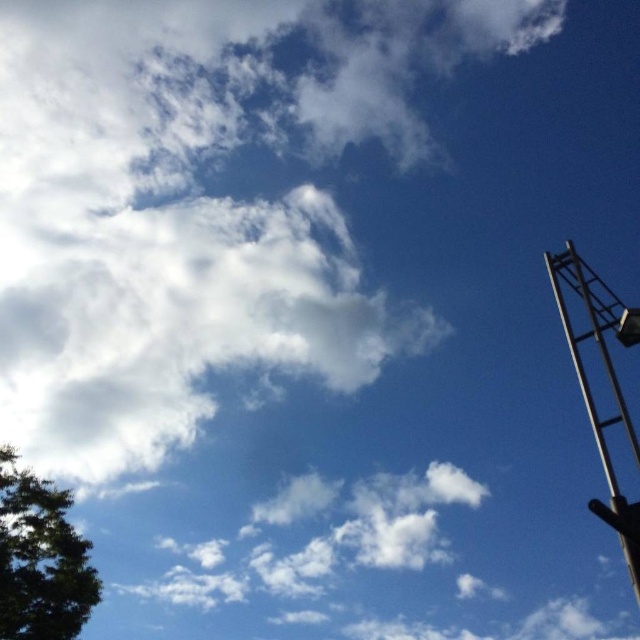
Question: Which of the following is the closest to the observer?

Choices:
 (A) metallic silver crane at right
 (B) green leafy tree at lower left
 (C) white fluffy cloud at upper center

Answer: (A)

Question: Can you confirm if green leafy tree at lower left is positioned to the right of metallic silver crane at right?

Choices:
 (A) yes
 (B) no

Answer: (B)

Question: Which of the following is the closest to the observer?

Choices:
 (A) green leafy tree at lower left
 (B) white fluffy cloud at upper center

Answer: (B)

Question: Which point is farther to the camera?

Choices:
 (A) green leafy tree at lower left
 (B) metallic silver crane at right

Answer: (A)

Question: In this image, where is green leafy tree at lower left located relative to metallic silver crane at right?

Choices:
 (A) above
 (B) below

Answer: (B)

Question: Can you confirm if white fluffy cloud at upper center is bigger than metallic silver crane at right?

Choices:
 (A) yes
 (B) no

Answer: (A)